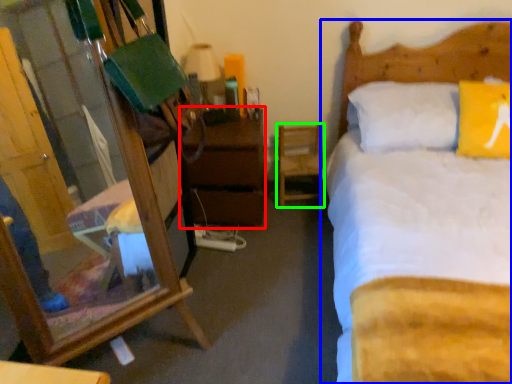
Question: Estimate the real-world distances between objects in this image. Which object is closer to nightstand (highlighted by a red box), bed (highlighted by a blue box) or chair (highlighted by a green box)?

Choices:
 (A) bed
 (B) chair

Answer: (B)